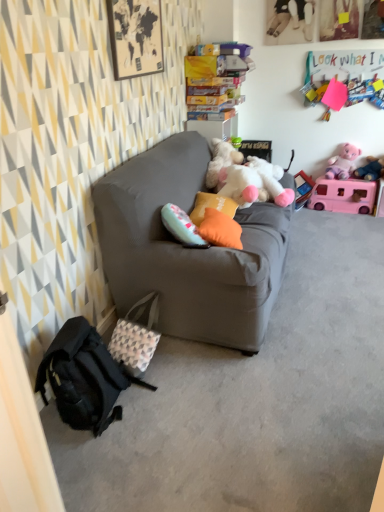
You are a GUI agent. You are given a task and a screenshot of the screen. Output one action in this format:
    pyautogui.click(x=<x>, y=<y>)
    Task: Click on the free spot in front of black fabric backpack at lower left
    The image size is (384, 512).
    Given the screenshot: What is the action you would take?
    pyautogui.click(x=109, y=465)